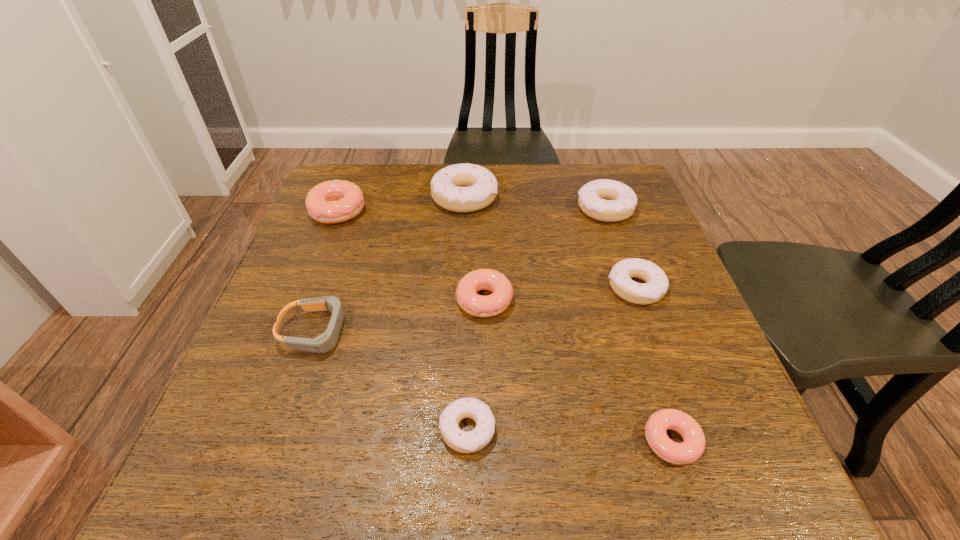
At what (x,y) coordinates should I click in order to perform the action: click on the biggest white doughnut. Please return your answer as a coordinate pair (x, y). The height and width of the screenshot is (540, 960). Looking at the image, I should click on (463, 188).

Identify the location of the biggest pink doughnut. This screenshot has height=540, width=960. (335, 201).

This screenshot has height=540, width=960. Identify the location of the farthest pink doughnut. (335, 201).

The height and width of the screenshot is (540, 960). I want to click on the third smallest white doughnut, so click(x=606, y=200).

Identify the location of the second biggest pink doughnut. This screenshot has width=960, height=540. (477, 305).

At what (x,y) coordinates should I click in order to perform the action: click on the second pink doughnut from left to right. Please return your answer as a coordinate pair (x, y). The width and height of the screenshot is (960, 540). Looking at the image, I should click on (477, 305).

The height and width of the screenshot is (540, 960). Find the location of `the second nearest white doughnut`. the second nearest white doughnut is located at coordinates (657, 283).

You are a GUI agent. You are given a task and a screenshot of the screen. Output one action in this format:
    pyautogui.click(x=<x>, y=<y>)
    Task: Click on the goggles
    
    Given the screenshot: What is the action you would take?
    pyautogui.click(x=325, y=342)

Locate an element on the screen. This screenshot has height=540, width=960. the smallest pink doughnut is located at coordinates (693, 445).

The width and height of the screenshot is (960, 540). I want to click on the nearest pink doughnut, so click(x=693, y=445).